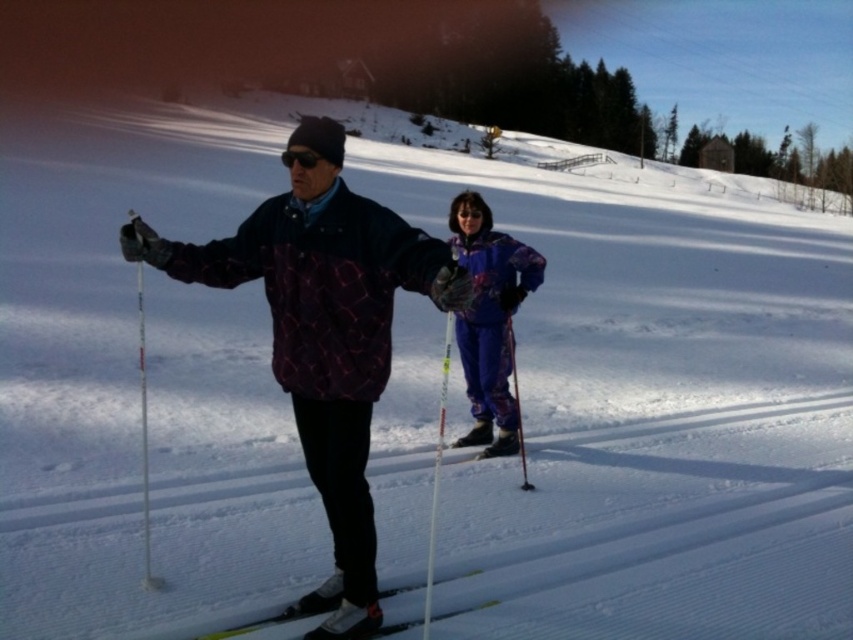
You are a photographer trying to capture a photo of both the male skier and the female skier in the image. You notice two specific points marked as point 1 at coordinates point (357, 451) and point 2 at coordinates point (415, 588). Which point is better to focus on if you want to ensure both skiers are in sharp focus?

Point 1 at coordinates point (357, 451) is closer to the camera than point 2 at coordinates point (415, 588), so focusing on point 1 would ensure both skiers are in sharp focus because it is closer to the camera.

You are a photographer trying to capture a photo of both the matte purple jacket at center and the matte purple ski suit at center. Which one should you focus on first to ensure both are in frame?

The matte purple jacket at center is to the left of the matte purple ski suit at center, so you should focus on the matte purple jacket at center first to ensure both are in frame.

You are planning to rent winter clothing for cross country skiing. You see two options in the image, the matte purple jacket at center and the matte purple ski suit at center. Which one is more suitable for a petite person?

The matte purple jacket at center has a smaller size compared to the matte purple ski suit at center, so the matte purple jacket at center is more suitable for a petite person.